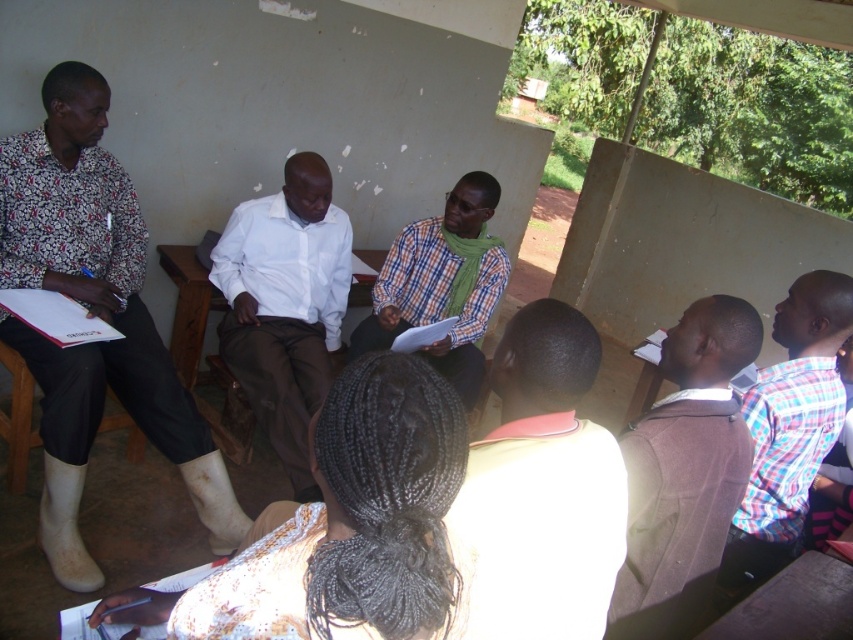
Question: Can you confirm if white matte shirt at center is positioned below plaid fabric shirt at right?

Choices:
 (A) no
 (B) yes

Answer: (A)

Question: Can you confirm if plaid fabric shirt at right is bigger than checkered fabric shirt at center?

Choices:
 (A) no
 (B) yes

Answer: (B)

Question: Which object appears farthest from the camera in this image?

Choices:
 (A) printed fabric shirt at left
 (B) white matte shirt at center
 (C) brown woolen sweater at upper right
 (D) plaid fabric shirt at right

Answer: (A)

Question: Which point appears closest to the camera in this image?

Choices:
 (A) (281, 310)
 (B) (445, 336)
 (C) (38, 188)
 (D) (743, 572)

Answer: (D)

Question: Which point is farther from the camera taking this photo?

Choices:
 (A) (640, 547)
 (B) (613, 460)
 (C) (239, 224)

Answer: (C)

Question: Does printed fabric shirt at left appear under white shirt at center?

Choices:
 (A) yes
 (B) no

Answer: (B)